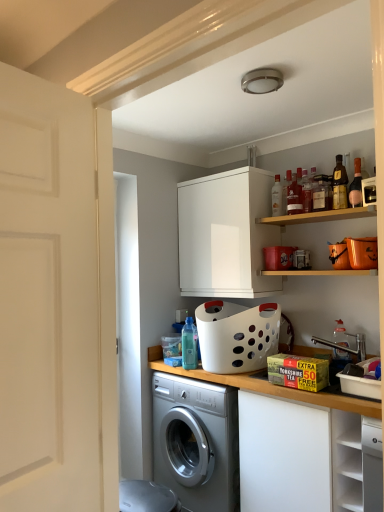
I want to click on vacant region to the left of pink glass bottle at upper right, acting as the first bottle starting from the right, so click(x=336, y=211).